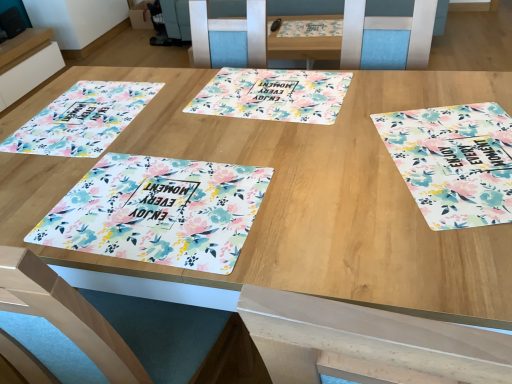
Question: Does floral printed placemat at lower left, the 2th tablecloth when ordered from left to right, have a greater width compared to white glossy placemat at upper left?

Choices:
 (A) yes
 (B) no

Answer: (B)

Question: Is white glossy placemat at upper left at the back of floral printed placemat at lower left, the 2th tablecloth when ordered from left to right?

Choices:
 (A) yes
 (B) no

Answer: (B)

Question: From a real-world perspective, is floral printed placemat at lower left, the 2th tablecloth when ordered from left to right, beneath white glossy placemat at upper left?

Choices:
 (A) yes
 (B) no

Answer: (B)

Question: Is floral printed placemat at lower left, the second tablecloth when ordered from right to left, with white glossy placemat at upper left?

Choices:
 (A) no
 (B) yes

Answer: (A)

Question: Could you tell me if floral printed placemat at lower left, the second tablecloth when ordered from right to left, is turned towards white glossy placemat at upper left?

Choices:
 (A) no
 (B) yes

Answer: (A)

Question: Considering the relative sizes of floral printed placemat at lower left, the 2th tablecloth when ordered from left to right, and white glossy placemat at upper left in the image provided, is floral printed placemat at lower left, the 2th tablecloth when ordered from left to right, shorter than white glossy placemat at upper left?

Choices:
 (A) no
 (B) yes

Answer: (B)

Question: Is floral printed placemat at lower left, the second tablecloth when ordered from right to left, to the right of floral printed placemat at left, arranged as the 3th tablecloth when viewed from the right, from the viewer's perspective?

Choices:
 (A) yes
 (B) no

Answer: (A)

Question: Is floral printed placemat at lower left, the second tablecloth when ordered from right to left, positioned far away from floral printed placemat at left, arranged as the 3th tablecloth when viewed from the right?

Choices:
 (A) no
 (B) yes

Answer: (A)

Question: Are floral printed placemat at lower left, the 2th tablecloth when ordered from left to right, and floral printed placemat at left, arranged as the 3th tablecloth when viewed from the right, beside each other?

Choices:
 (A) no
 (B) yes

Answer: (A)

Question: Does floral printed placemat at lower left, the 2th tablecloth when ordered from left to right, have a greater height compared to floral printed placemat at left, acting as the 1th tablecloth starting from the left?

Choices:
 (A) no
 (B) yes

Answer: (B)

Question: Is floral printed placemat at lower left, the 2th tablecloth when ordered from left to right, thinner than floral printed placemat at left, arranged as the 3th tablecloth when viewed from the right?

Choices:
 (A) no
 (B) yes

Answer: (B)

Question: From a real-world perspective, is floral printed placemat at lower left, the 2th tablecloth when ordered from left to right, located beneath floral printed placemat at left, acting as the 1th tablecloth starting from the left?

Choices:
 (A) yes
 (B) no

Answer: (A)

Question: Is floral fabric placemat at right, acting as the first tablecloth starting from the right, at the left side of floral printed placemat at left, acting as the 1th tablecloth starting from the left?

Choices:
 (A) yes
 (B) no

Answer: (B)